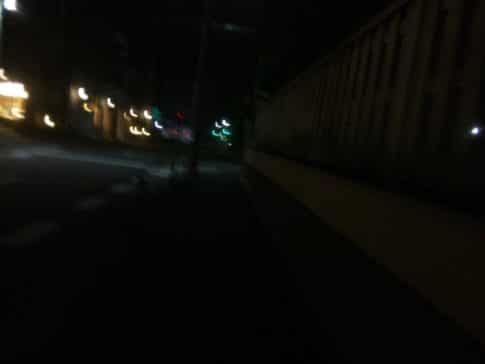
Find the location of a particular element. This screenshot has width=485, height=364. dark floor is located at coordinates (201, 255).